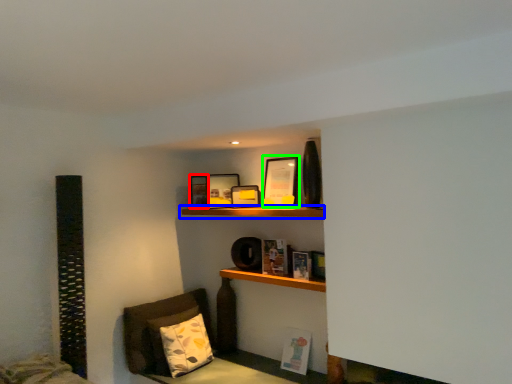
Question: Estimate the real-world distances between objects in this image. Which object is closer to picture frame (highlighted by a red box), shelf (highlighted by a blue box) or picture frame (highlighted by a green box)?

Choices:
 (A) shelf
 (B) picture frame

Answer: (A)